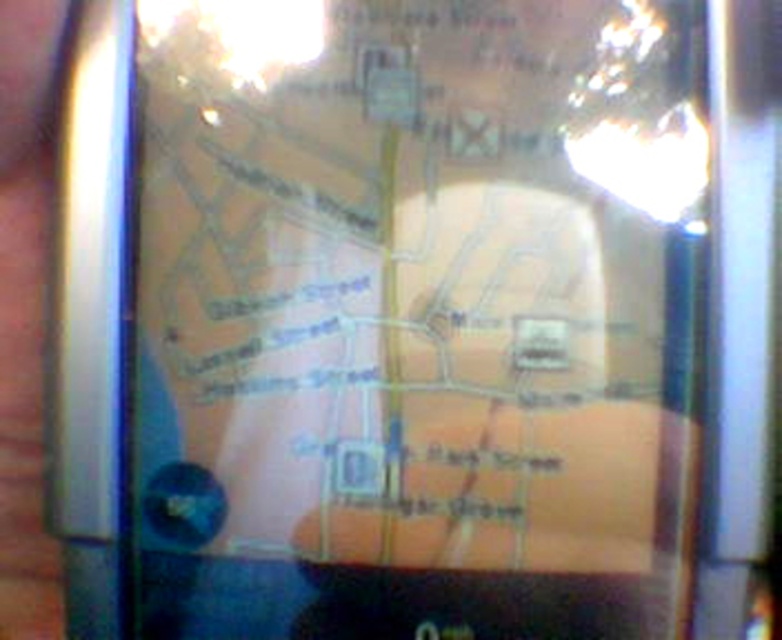
You are an architect holding a gold metallic pen at center and need to sign a translucent plastic map at center. Can you reach the map without moving your hand if the pen is 15 centimeters away?

The translucent plastic map at center and gold metallic pen at center are 14.85 centimeters apart from each other, so yes, you can reach the map without moving your hand since the distance is just under 15 centimeters.

You are an architect reviewing a design plan and need to compare the dimensions of the translucent plastic map at center and the gold metallic pen at center. Which object is wider?

The translucent plastic map at center is wider than the gold metallic pen at center.